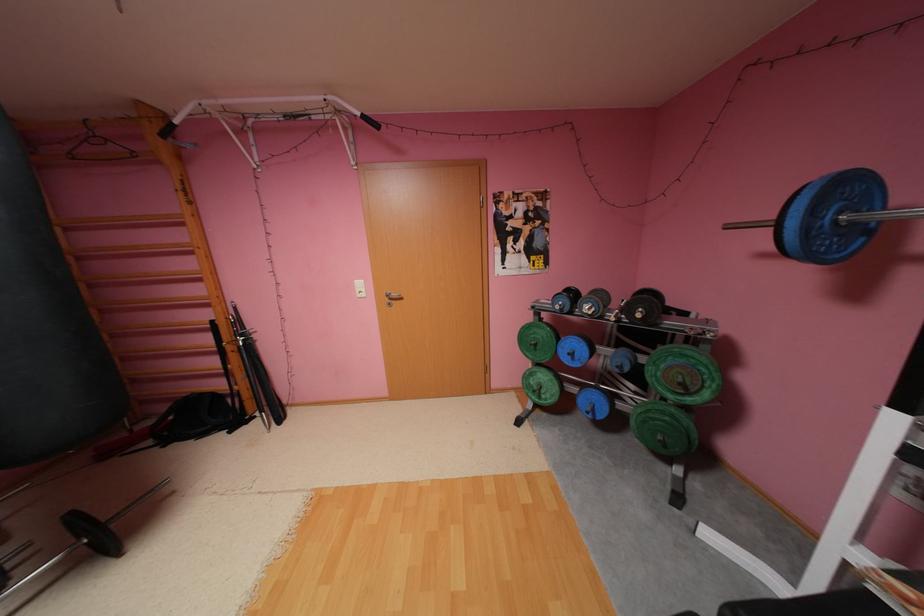
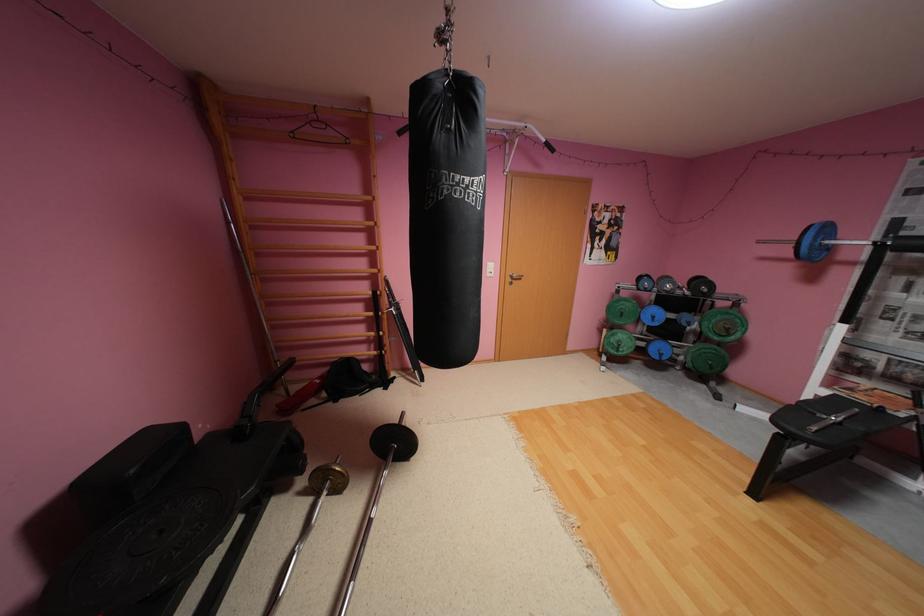
The point at (x=549, y=398) is marked in the first image. Where is the corresponding point in the second image?

(626, 351)